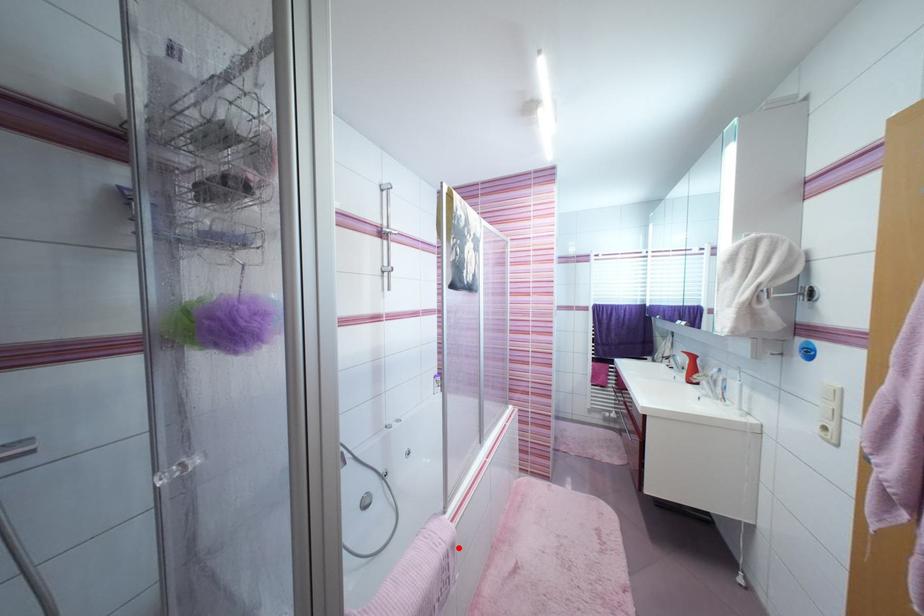
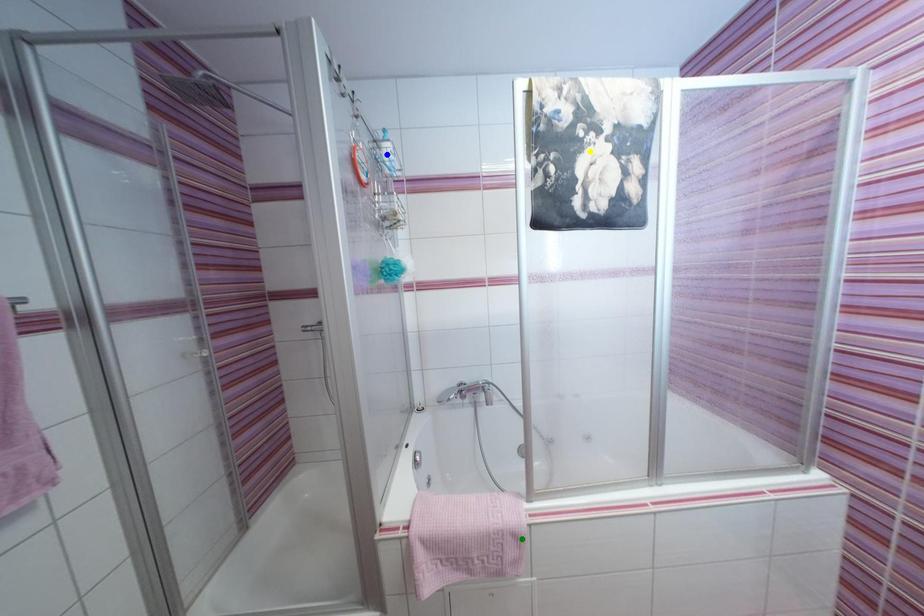
Question: I am providing you with two images of the same scene from different viewpoints. A red point is marked on the first image. You are given multiple points on the second image. Which point in image 2 is actually the same real-world point as the red point in image 1?

Choices:
 (A) green point
 (B) yellow point
 (C) blue point

Answer: (A)